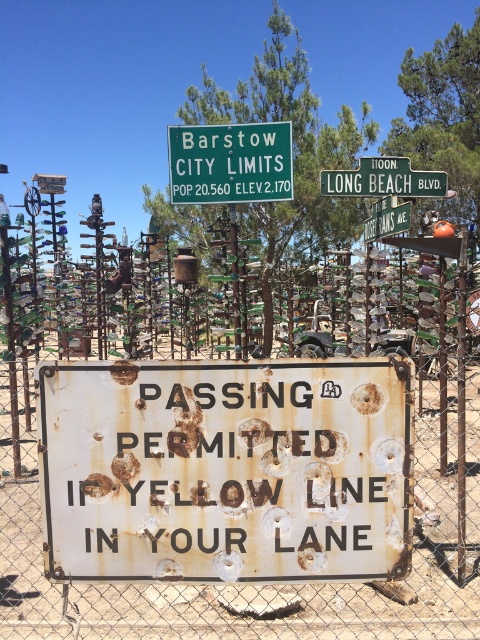
Question: Among these objects, which one is nearest to the camera?

Choices:
 (A) green metal sign at upper center
 (B) rusty metal fence at center
 (C) rusty metal sign at center

Answer: (C)

Question: Can you confirm if rusty metal fence at center is wider than green metallic street sign at upper center?

Choices:
 (A) yes
 (B) no

Answer: (B)

Question: Does rusty metal sign at center appear on the right side of green metallic street sign at upper center?

Choices:
 (A) no
 (B) yes

Answer: (A)

Question: Which of the following is the closest to the observer?

Choices:
 (A) green metallic street sign at upper center
 (B) rusty metal fence at center
 (C) rusty metal sign at center
 (D) green metal sign at upper center

Answer: (C)

Question: Which object is the closest to the green metal sign at upper center?

Choices:
 (A) green plastic street sign at upper center
 (B) rusty metal fence at center
 (C) green metallic street sign at upper center
 (D) rusty metal sign at center

Answer: (C)

Question: Can you confirm if rusty metal fence at center is smaller than green metallic street sign at upper center?

Choices:
 (A) no
 (B) yes

Answer: (B)